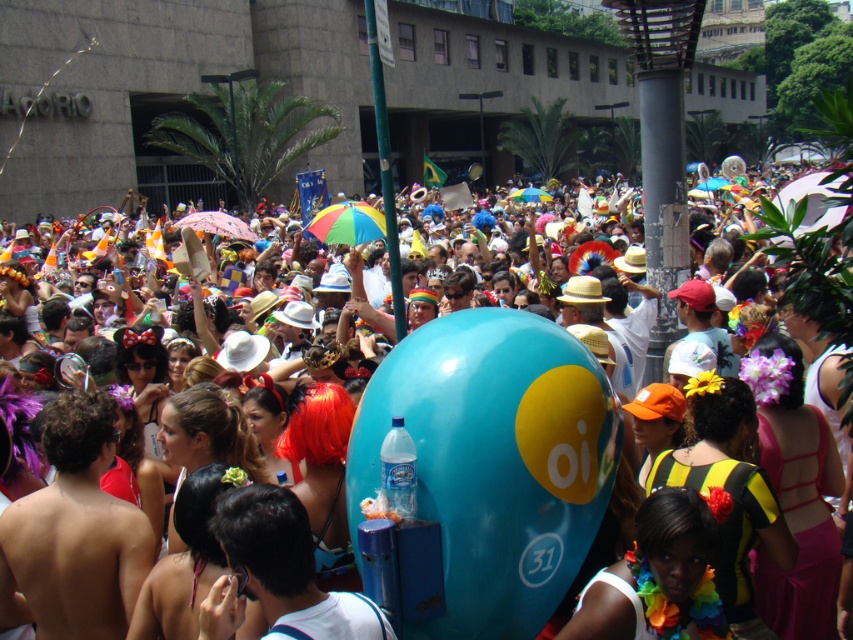
You are a photographer at the carnival trying to capture the blue glossy balloon at center and the multicolored fabric lei at center in a single frame. Which object should you focus on first to ensure both are in the shot?

You should focus on the blue glossy balloon at center first because it is positioned over the multicolored fabric lei at center, so adjusting the camera to include the higher object will naturally include the lower one as well.